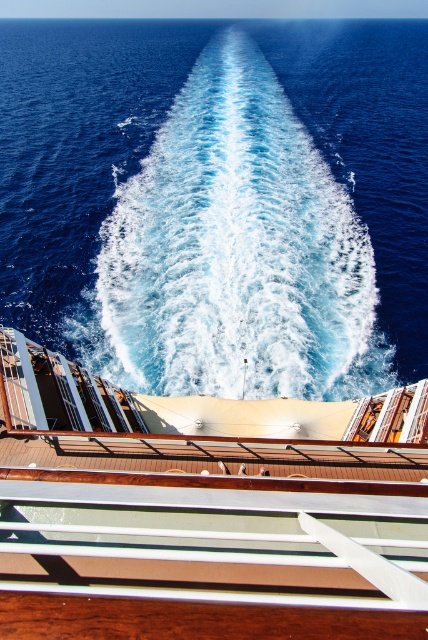
Question: Is blue liquid water at center below brown wooden deck at center?

Choices:
 (A) no
 (B) yes

Answer: (A)

Question: Which object appears farthest from the camera in this image?

Choices:
 (A) blue liquid water at center
 (B) brown wooden deck at center

Answer: (A)

Question: Among these objects, which one is farthest from the camera?

Choices:
 (A) brown wooden deck at center
 (B) blue liquid water at center

Answer: (B)

Question: Does blue liquid water at center appear on the right side of brown wooden deck at center?

Choices:
 (A) yes
 (B) no

Answer: (A)

Question: Among these objects, which one is farthest from the camera?

Choices:
 (A) brown wooden deck at center
 (B) blue liquid water at center

Answer: (B)

Question: Does blue liquid water at center come in front of brown wooden deck at center?

Choices:
 (A) no
 (B) yes

Answer: (A)